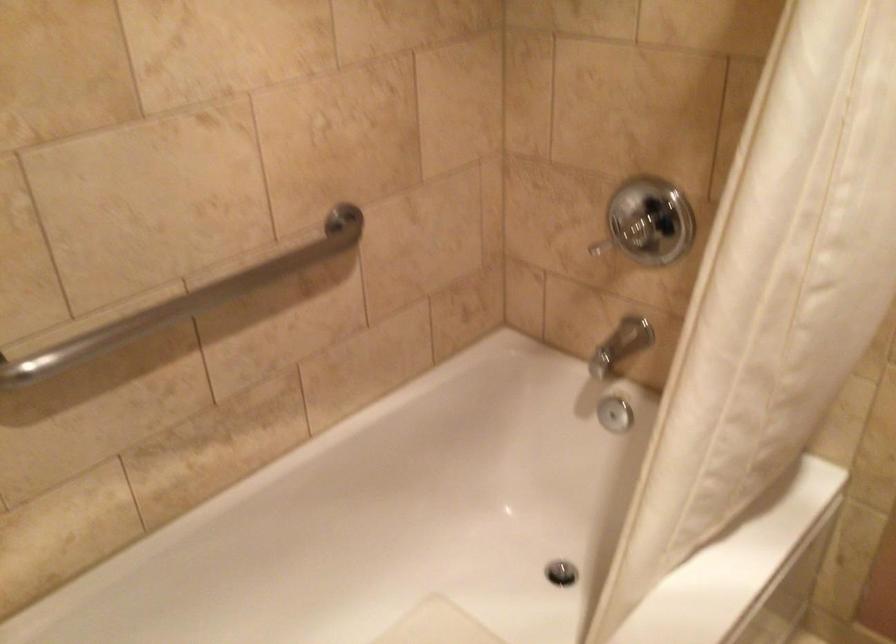
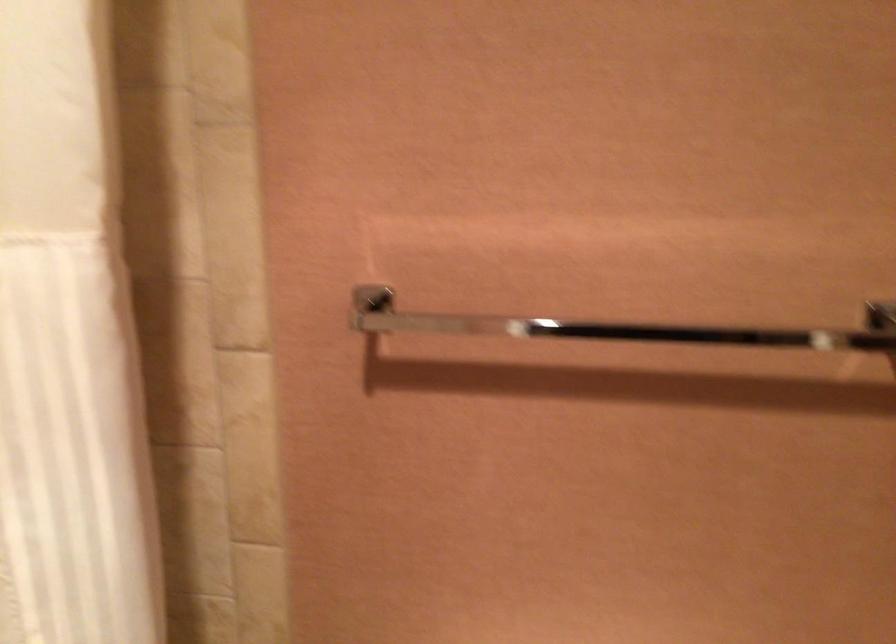
Question: The camera is either moving clockwise (left) or counter-clockwise (right) around the object. The first image is from the beginning of the video and the second image is from the end. Is the camera moving left or right when shooting the video?

Choices:
 (A) Left
 (B) Right

Answer: (A)